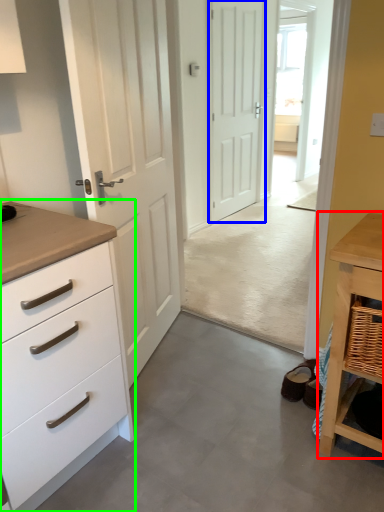
Question: Considering the real-world distances, which object is closest to table (highlighted by a red box)? door (highlighted by a blue box) or chest of drawers (highlighted by a green box).

Choices:
 (A) door
 (B) chest of drawers

Answer: (B)